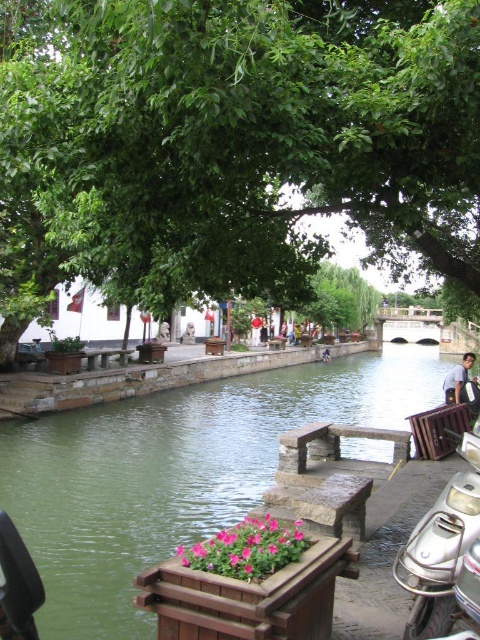
Question: Is green leafy tree at upper center above green stone river at center?

Choices:
 (A) no
 (B) yes

Answer: (B)

Question: Where is green leafy tree at upper center located in relation to silver metallic motorcycle at lower right in the image?

Choices:
 (A) above
 (B) below

Answer: (A)

Question: Considering the real-world distances, which object is farthest from the green stone river at center?

Choices:
 (A) matte white shirt at center
 (B) green leafy tree at upper center
 (C) silver metallic motorcycle at lower right

Answer: (C)

Question: Which of the following is the closest to the observer?

Choices:
 (A) green leafy tree at upper center
 (B) matte white shirt at center
 (C) silver metallic motorcycle at lower right

Answer: (A)

Question: In this image, where is green stone river at center located relative to silver metallic motorcycle at lower right?

Choices:
 (A) above
 (B) below

Answer: (B)

Question: Among these objects, which one is nearest to the camera?

Choices:
 (A) green stone river at center
 (B) silver metallic motorcycle at lower right

Answer: (B)